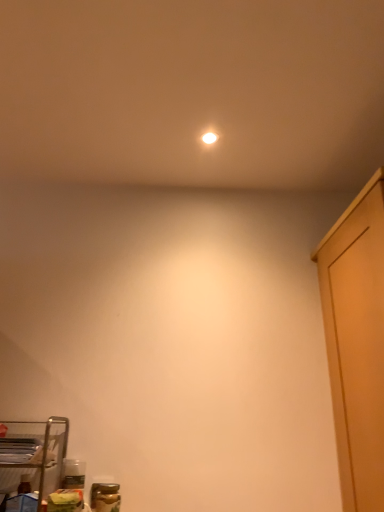
Question: From a real-world perspective, is white glossy light bulb at upper center physically located above or below metal wire rack at lower left?

Choices:
 (A) above
 (B) below

Answer: (A)

Question: From the image's perspective, is white glossy light bulb at upper center located above or below metal wire rack at lower left?

Choices:
 (A) below
 (B) above

Answer: (B)

Question: Is white glossy light bulb at upper center in front of or behind metal wire rack at lower left in the image?

Choices:
 (A) behind
 (B) front

Answer: (A)

Question: Is metal wire rack at lower left bigger or smaller than white glossy light bulb at upper center?

Choices:
 (A) small
 (B) big

Answer: (B)

Question: From a real-world perspective, is metal wire rack at lower left above or below white glossy light bulb at upper center?

Choices:
 (A) above
 (B) below

Answer: (B)

Question: Do you think metal wire rack at lower left is within white glossy light bulb at upper center, or outside of it?

Choices:
 (A) inside
 (B) outside

Answer: (B)

Question: Visually, is metal wire rack at lower left positioned to the left or to the right of white glossy light bulb at upper center?

Choices:
 (A) right
 (B) left

Answer: (B)